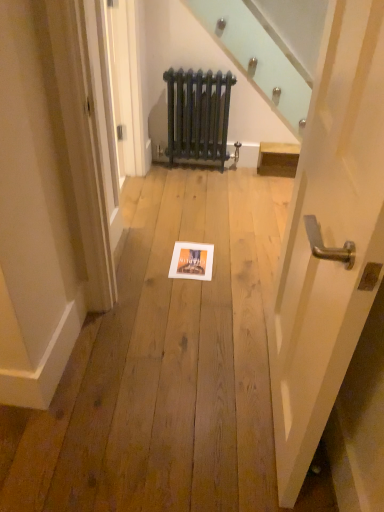
What are the coordinates of `unoccupied region to the right of dark blue cast iron radiator at center` in the screenshot? It's located at click(x=250, y=173).